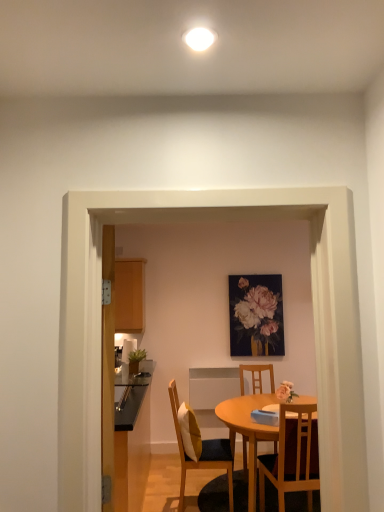
Question: Is wooden cabinet at left far away from glossy black countertop at left?

Choices:
 (A) yes
 (B) no

Answer: (A)

Question: Does wooden cabinet at left have a smaller size compared to glossy black countertop at left?

Choices:
 (A) no
 (B) yes

Answer: (A)

Question: From a real-world perspective, is wooden cabinet at left over glossy black countertop at left?

Choices:
 (A) no
 (B) yes

Answer: (B)

Question: Is wooden cabinet at left bigger than glossy black countertop at left?

Choices:
 (A) no
 (B) yes

Answer: (B)

Question: Is glossy black countertop at left at the back of wooden cabinet at left?

Choices:
 (A) yes
 (B) no

Answer: (B)

Question: Is wooden cabinet at left with glossy black countertop at left?

Choices:
 (A) yes
 (B) no

Answer: (B)

Question: Is wooden cushioned chair at center, the 2th chair when ordered from back to front, positioned before wooden chair at center, positioned as the 2th chair in left-to-right order?

Choices:
 (A) no
 (B) yes

Answer: (B)

Question: Is wooden cushioned chair at center, the 2th chair when ordered from back to front, facing away from wooden chair at center, positioned as the 2th chair in left-to-right order?

Choices:
 (A) yes
 (B) no

Answer: (B)

Question: From a real-world perspective, does wooden cushioned chair at center, the 2th chair when ordered from back to front, sit lower than wooden chair at center, which ranks as the 2th chair in right-to-left order?

Choices:
 (A) yes
 (B) no

Answer: (B)

Question: Would you say wooden cushioned chair at center, the 2th chair when ordered from back to front, is outside wooden chair at center, positioned as the 2th chair in left-to-right order?

Choices:
 (A) yes
 (B) no

Answer: (A)

Question: Does wooden cushioned chair at center, the 1th chair from the left, have a greater width compared to wooden chair at center, which is counted as the third chair, starting from the front?

Choices:
 (A) yes
 (B) no

Answer: (B)

Question: From a real-world perspective, is wooden cushioned chair at center, the third chair in the right-to-left sequence, on top of wooden chair at center, which ranks as the 2th chair in right-to-left order?

Choices:
 (A) yes
 (B) no

Answer: (A)

Question: Considering the relative sizes of wooden table at center and wooden cushioned chair at center, the third chair in the right-to-left sequence, in the image provided, is wooden table at center thinner than wooden cushioned chair at center, the third chair in the right-to-left sequence,?

Choices:
 (A) no
 (B) yes

Answer: (A)